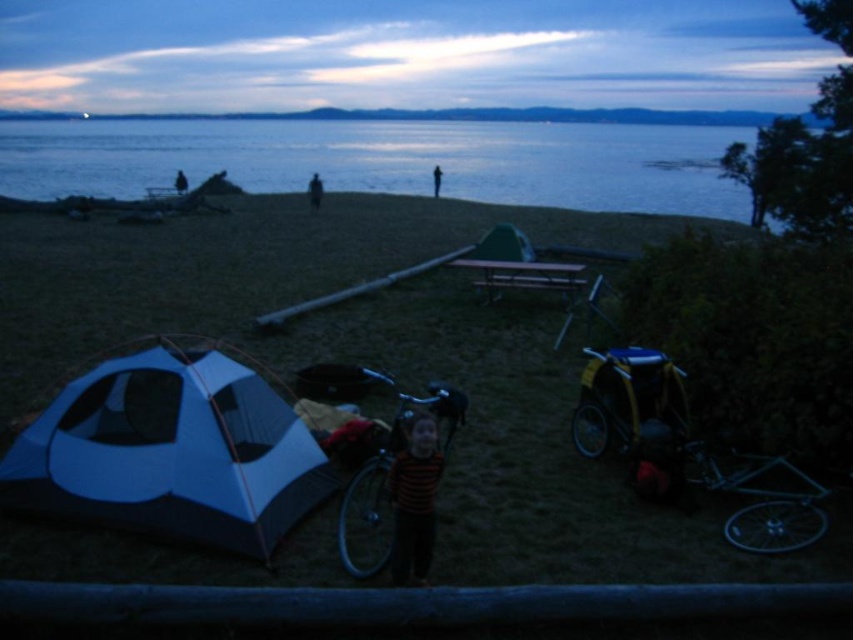
Does blue water at upper center come in front of dark blue fabric tent at center?

Yes, blue water at upper center is closer to the viewer.

Based on the photo, between blue water at upper center and dark blue fabric tent at center, which one is positioned lower?

dark blue fabric tent at center

The image size is (853, 640). Describe the element at coordinates (387, 161) in the screenshot. I see `blue water at upper center` at that location.

The width and height of the screenshot is (853, 640). I want to click on blue water at upper center, so click(387, 161).

What do you see at coordinates (180, 182) in the screenshot? This screenshot has height=640, width=853. I see `dark blue fabric tent at center` at bounding box center [180, 182].

Is point (183, 180) farther from camera compared to point (432, 170)?

No, it is in front of (432, 170).

The height and width of the screenshot is (640, 853). Identify the location of dark blue fabric tent at center. (180, 182).

Which of these two, blue fabric tent at lower left or dark blue jeans at center, stands taller?

dark blue jeans at center

At what (x,y) coordinates should I click in order to perform the action: click on blue fabric tent at lower left. Please return your answer as a coordinate pair (x, y). Looking at the image, I should click on (171, 452).

The width and height of the screenshot is (853, 640). What do you see at coordinates (171, 452) in the screenshot? I see `blue fabric tent at lower left` at bounding box center [171, 452].

This screenshot has width=853, height=640. Identify the location of blue fabric tent at lower left. (171, 452).